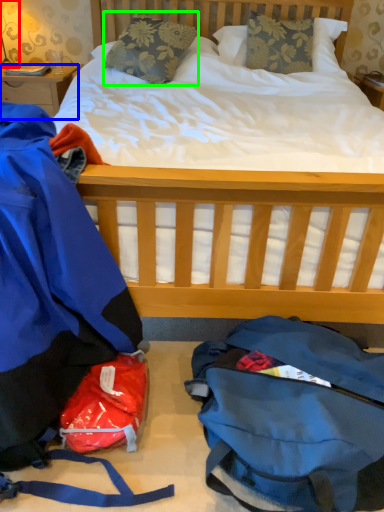
Question: Considering the real-world distances, which object is closest to lamp (highlighted by a red box)? desk (highlighted by a blue box) or pillow (highlighted by a green box).

Choices:
 (A) desk
 (B) pillow

Answer: (A)